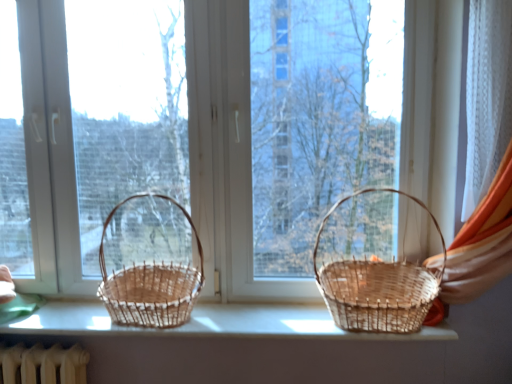
Where is `woven brown picnic basket at left, which ranks as the 2th picnic basket in right-to-left order`? This screenshot has height=384, width=512. woven brown picnic basket at left, which ranks as the 2th picnic basket in right-to-left order is located at coordinates (151, 263).

Find the location of a particular element. This screenshot has width=512, height=384. woven natural basket at right, the second picnic basket viewed from the left is located at coordinates (371, 267).

Does natural wood baskets at center appear on the right side of woven wood baskets at center?

No, natural wood baskets at center is not to the right of woven wood baskets at center.

Which is in front, point (275, 297) or point (292, 325)?

Point (292, 325)

Between natural wood baskets at center and woven wood baskets at center, which one has less height?

woven wood baskets at center.

Based on the photo, is woven brown picnic basket at left, which ranks as the 2th picnic basket in right-to-left order, oriented away from woven wood baskets at center?

No, woven wood baskets at center is not at the back of woven brown picnic basket at left, which ranks as the 2th picnic basket in right-to-left order.

Who is shorter, woven brown picnic basket at left, which ranks as the 2th picnic basket in right-to-left order, or woven wood baskets at center?

woven wood baskets at center is shorter.

Based on their sizes in the image, would you say woven brown picnic basket at left, which ranks as the 2th picnic basket in right-to-left order, is bigger or smaller than woven wood baskets at center?

woven brown picnic basket at left, which ranks as the 2th picnic basket in right-to-left order, is bigger than woven wood baskets at center.

Is woven brown picnic basket at left, which ranks as the 1th picnic basket in left-to-right order, far from woven wood baskets at center?

woven brown picnic basket at left, which ranks as the 1th picnic basket in left-to-right order, is actually quite close to woven wood baskets at center.

Based on the photo, what's the angular difference between woven brown picnic basket at left, which ranks as the 2th picnic basket in right-to-left order, and woven natural basket at right, placed as the 1th picnic basket when sorted from right to left,'s facing directions?

0.00012 degrees separate the facing orientations of woven brown picnic basket at left, which ranks as the 2th picnic basket in right-to-left order, and woven natural basket at right, placed as the 1th picnic basket when sorted from right to left.

Which of these two, woven brown picnic basket at left, which ranks as the 2th picnic basket in right-to-left order, or woven natural basket at right, placed as the 1th picnic basket when sorted from right to left, is thinner?

woven natural basket at right, placed as the 1th picnic basket when sorted from right to left.

Would you say woven natural basket at right, the second picnic basket viewed from the left, is part of woven brown picnic basket at left, which ranks as the 1th picnic basket in left-to-right order,'s contents?

That's incorrect, woven natural basket at right, the second picnic basket viewed from the left, is not inside woven brown picnic basket at left, which ranks as the 1th picnic basket in left-to-right order.

Between woven brown picnic basket at left, which ranks as the 2th picnic basket in right-to-left order, and woven natural basket at right, the second picnic basket viewed from the left, which one appears on the right side from the viewer's perspective?

woven natural basket at right, the second picnic basket viewed from the left.

Can you tell me how much natural wood baskets at center and woven natural basket at right, the second picnic basket viewed from the left, differ in facing direction?

The angular difference between natural wood baskets at center and woven natural basket at right, the second picnic basket viewed from the left, is 0.000489 degrees.

From the image's perspective, between natural wood baskets at center and woven natural basket at right, placed as the 1th picnic basket when sorted from right to left, which one is located above?

natural wood baskets at center is shown above in the image.

Is point (68, 103) positioned before point (388, 223)?

That is True.

From a real-world perspective, who is located lower, natural wood baskets at center or woven natural basket at right, placed as the 1th picnic basket when sorted from right to left?

From a 3D spatial view, woven natural basket at right, placed as the 1th picnic basket when sorted from right to left, is below.

Can you confirm if woven natural basket at right, placed as the 1th picnic basket when sorted from right to left, is positioned to the left of woven brown picnic basket at left, which ranks as the 2th picnic basket in right-to-left order?

No, woven natural basket at right, placed as the 1th picnic basket when sorted from right to left, is not to the left of woven brown picnic basket at left, which ranks as the 2th picnic basket in right-to-left order.

From a real-world perspective, does woven natural basket at right, placed as the 1th picnic basket when sorted from right to left, sit lower than woven brown picnic basket at left, which ranks as the 2th picnic basket in right-to-left order?

No, from a real-world perspective, woven natural basket at right, placed as the 1th picnic basket when sorted from right to left, is not beneath woven brown picnic basket at left, which ranks as the 2th picnic basket in right-to-left order.

Does woven natural basket at right, placed as the 1th picnic basket when sorted from right to left, touch woven brown picnic basket at left, which ranks as the 2th picnic basket in right-to-left order?

woven natural basket at right, placed as the 1th picnic basket when sorted from right to left, is not next to woven brown picnic basket at left, which ranks as the 2th picnic basket in right-to-left order, and they're not touching.

Based on the photo, considering the relative sizes of woven natural basket at right, the second picnic basket viewed from the left, and woven brown picnic basket at left, which ranks as the 2th picnic basket in right-to-left order, in the image provided, is woven natural basket at right, the second picnic basket viewed from the left, bigger than woven brown picnic basket at left, which ranks as the 2th picnic basket in right-to-left order,?

Indeed, woven natural basket at right, the second picnic basket viewed from the left, has a larger size compared to woven brown picnic basket at left, which ranks as the 2th picnic basket in right-to-left order.

Which is behind, point (366, 250) or point (214, 309)?

The point (366, 250) is farther from the camera.

Looking at this image, can we say woven natural basket at right, placed as the 1th picnic basket when sorted from right to left, lies outside woven wood baskets at center?

Yes.

From a real-world perspective, which object rests below the other?

woven wood baskets at center, from a real-world perspective.

Locate an element on the screen. The height and width of the screenshot is (384, 512). picnic basket on the right side of woven wood baskets at center is located at coordinates coord(371,267).

Between point (18, 329) and point (414, 21), which one is positioned in front?

The point (18, 329) is more forward.

Is the depth of woven wood baskets at center greater than that of natural wood baskets at center?

That is False.

Can you confirm if woven wood baskets at center is bigger than natural wood baskets at center?

Actually, woven wood baskets at center might be smaller than natural wood baskets at center.

Identify the location of window that appears above the woven wood baskets at center (from a real-world perspective). (226, 153).

Find the location of a particular element. The image size is (512, 384). window sill behind the woven brown picnic basket at left, which ranks as the 1th picnic basket in left-to-right order is located at coordinates (208, 323).

Which object lies nearer to the anchor point woven natural basket at right, the second picnic basket viewed from the left, woven wood baskets at center or woven brown picnic basket at left, which ranks as the 1th picnic basket in left-to-right order?

Based on the image, woven wood baskets at center appears to be nearer to woven natural basket at right, the second picnic basket viewed from the left.

From the image, which object appears to be farther from natural wood baskets at center, woven natural basket at right, placed as the 1th picnic basket when sorted from right to left, or woven wood baskets at center?

woven wood baskets at center is further to natural wood baskets at center.

Looking at the image, which one is located further to woven wood baskets at center, woven natural basket at right, the second picnic basket viewed from the left, or natural wood baskets at center?

natural wood baskets at center.

When comparing their distances from woven wood baskets at center, does woven natural basket at right, the second picnic basket viewed from the left, or woven brown picnic basket at left, which ranks as the 1th picnic basket in left-to-right order, seem closer?

The object closer to woven wood baskets at center is woven brown picnic basket at left, which ranks as the 1th picnic basket in left-to-right order.

Estimate the real-world distances between objects in this image. Which object is further from woven natural basket at right, the second picnic basket viewed from the left, woven brown picnic basket at left, which ranks as the 2th picnic basket in right-to-left order, or natural wood baskets at center?

The object further to woven natural basket at right, the second picnic basket viewed from the left, is woven brown picnic basket at left, which ranks as the 2th picnic basket in right-to-left order.

Based on their spatial positions, is woven wood baskets at center or woven natural basket at right, placed as the 1th picnic basket when sorted from right to left, closer to natural wood baskets at center?

woven natural basket at right, placed as the 1th picnic basket when sorted from right to left, is closer to natural wood baskets at center.

When comparing their distances from woven brown picnic basket at left, which ranks as the 1th picnic basket in left-to-right order, does woven natural basket at right, placed as the 1th picnic basket when sorted from right to left, or natural wood baskets at center seem further?

woven natural basket at right, placed as the 1th picnic basket when sorted from right to left, is positioned further to the anchor woven brown picnic basket at left, which ranks as the 1th picnic basket in left-to-right order.

Estimate the real-world distances between objects in this image. Which object is further from woven brown picnic basket at left, which ranks as the 1th picnic basket in left-to-right order, woven natural basket at right, placed as the 1th picnic basket when sorted from right to left, or woven wood baskets at center?

woven natural basket at right, placed as the 1th picnic basket when sorted from right to left, is positioned further to the anchor woven brown picnic basket at left, which ranks as the 1th picnic basket in left-to-right order.

The width and height of the screenshot is (512, 384). I want to click on window sill between natural wood baskets at center and woven natural basket at right, placed as the 1th picnic basket when sorted from right to left, so click(x=208, y=323).

I want to click on window between woven brown picnic basket at left, which ranks as the 1th picnic basket in left-to-right order, and woven natural basket at right, placed as the 1th picnic basket when sorted from right to left, in the horizontal direction, so click(x=226, y=153).

Find the location of `window sill between woven brown picnic basket at left, which ranks as the 1th picnic basket in left-to-right order, and woven natural basket at right, the second picnic basket viewed from the left, from left to right`. window sill between woven brown picnic basket at left, which ranks as the 1th picnic basket in left-to-right order, and woven natural basket at right, the second picnic basket viewed from the left, from left to right is located at coordinates (208, 323).